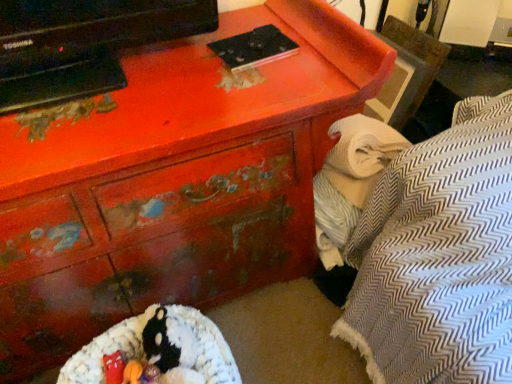
Question: Is white textured blanket at right aimed at fluffy white bean bag at lower center?

Choices:
 (A) no
 (B) yes

Answer: (A)

Question: From a real-world perspective, does white textured blanket at right sit lower than fluffy white bean bag at lower center?

Choices:
 (A) no
 (B) yes

Answer: (A)

Question: Is white textured blanket at right smaller than fluffy white bean bag at lower center?

Choices:
 (A) yes
 (B) no

Answer: (A)

Question: Considering the relative sizes of white textured blanket at right and fluffy white bean bag at lower center in the image provided, is white textured blanket at right taller than fluffy white bean bag at lower center?

Choices:
 (A) no
 (B) yes

Answer: (B)

Question: Is white textured blanket at right completely or partially outside of fluffy white bean bag at lower center?

Choices:
 (A) yes
 (B) no

Answer: (A)

Question: From the image's perspective, is white textured blanket at right on fluffy white bean bag at lower center?

Choices:
 (A) no
 (B) yes

Answer: (B)

Question: Considering the relative positions of fluffy white bean bag at lower center and white textured blanket at right in the image provided, is fluffy white bean bag at lower center to the right of white textured blanket at right from the viewer's perspective?

Choices:
 (A) no
 (B) yes

Answer: (A)

Question: Is fluffy white bean bag at lower center closer to the viewer compared to white textured blanket at right?

Choices:
 (A) yes
 (B) no

Answer: (A)

Question: Is fluffy white bean bag at lower center outside white textured blanket at right?

Choices:
 (A) yes
 (B) no

Answer: (A)

Question: Is fluffy white bean bag at lower center aimed at white textured blanket at right?

Choices:
 (A) yes
 (B) no

Answer: (B)

Question: Does fluffy white bean bag at lower center have a larger size compared to white textured blanket at right?

Choices:
 (A) yes
 (B) no

Answer: (A)

Question: Is fluffy white bean bag at lower center not near white textured blanket at right?

Choices:
 (A) no
 (B) yes

Answer: (A)

Question: Is point (377, 162) positioned closer to the camera than point (103, 340)?

Choices:
 (A) farther
 (B) closer

Answer: (A)